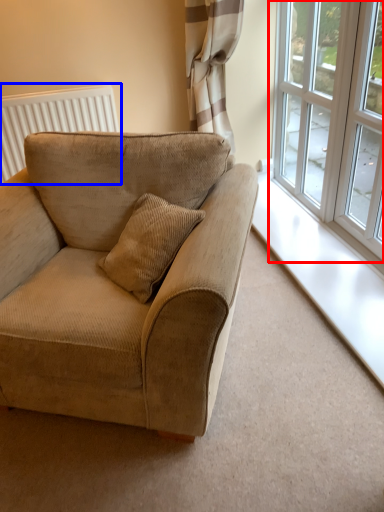
Question: Which of the following is the farthest to the observer, window (highlighted by a red box) or radiator (highlighted by a blue box)?

Choices:
 (A) window
 (B) radiator

Answer: (B)